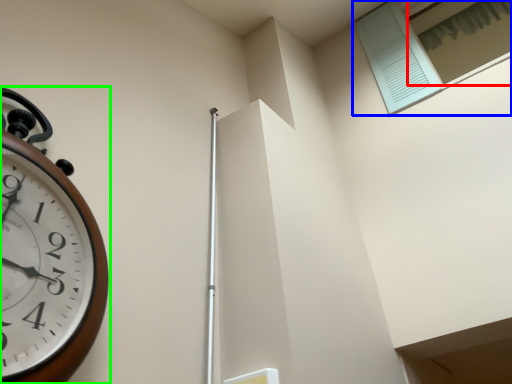
Question: Considering the real-world distances, which object is farthest from window (highlighted by a red box)? window (highlighted by a blue box) or wall clock (highlighted by a green box)?

Choices:
 (A) window
 (B) wall clock

Answer: (B)